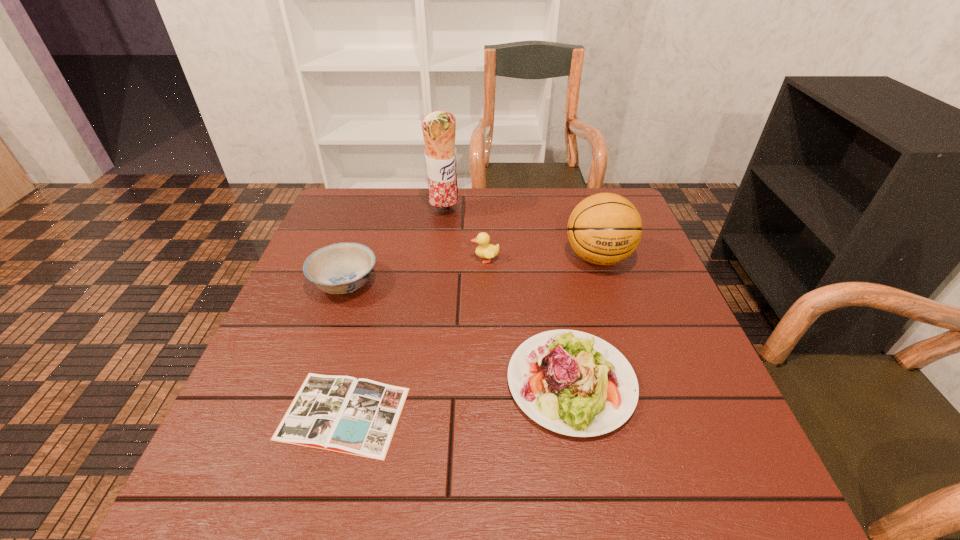
Locate an element on the screen. The image size is (960, 540). vacant region between the tallest object and the salad plate is located at coordinates (508, 297).

Find the location of a particular element. The height and width of the screenshot is (540, 960). free space between the duckling and the book is located at coordinates point(415,336).

Where is `empty location between the shortest object and the fourth object from left to right`? empty location between the shortest object and the fourth object from left to right is located at coordinates (415, 336).

You are a GUI agent. You are given a task and a screenshot of the screen. Output one action in this format:
    pyautogui.click(x=<x>, y=<y>)
    Task: Click on the vacant area that lies between the basketball and the salad plate
    The width and height of the screenshot is (960, 540).
    Given the screenshot: What is the action you would take?
    pyautogui.click(x=585, y=320)

I want to click on unoccupied position between the third tallest object and the fifth tallest object, so [528, 321].

Identify the location of empty space that is in between the shortest object and the fourth object from left to right. This screenshot has height=540, width=960. (415, 336).

Choose which object is the second nearest neighbor to the second shortest object. Please provide its 2D coordinates. Your answer should be formatted as a tuple, i.e. [(x, y)], where the tuple contains the x and y coordinates of a point satisfying the conditions above.

[(338, 413)]

The image size is (960, 540). Identify the location of the third closest object relative to the salad plate. (484, 250).

The image size is (960, 540). I want to click on free space that satisfies the following two spatial constraints: 1. on the back side of the farthest object; 2. on the right side of the fourth tallest object, so click(x=370, y=212).

The height and width of the screenshot is (540, 960). What are the coordinates of `free space that satisfies the following two spatial constraints: 1. on the back side of the bowl; 2. on the left side of the farthest object` in the screenshot? It's located at (370, 212).